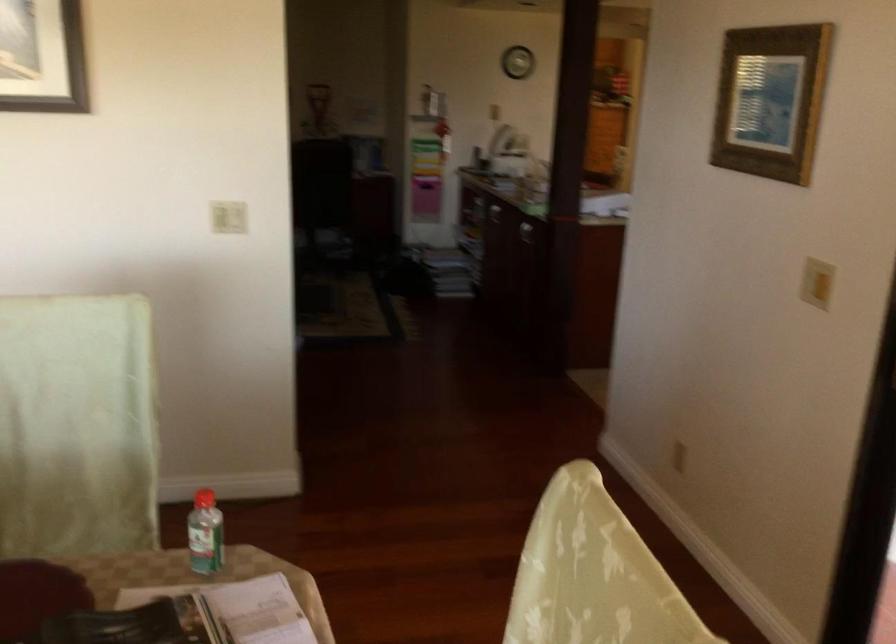
Describe the element at coordinates (203, 498) in the screenshot. I see `a red bottle cap` at that location.